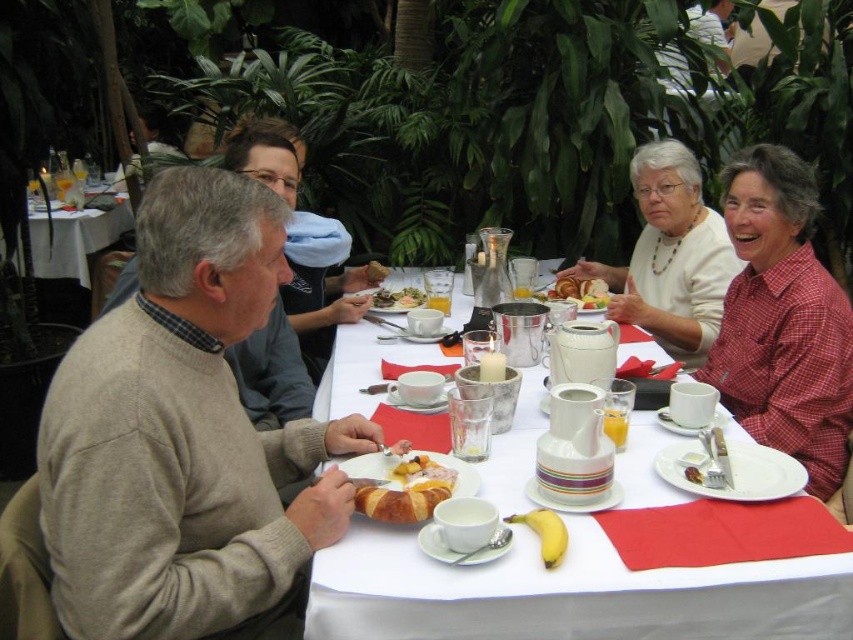
Question: Can you confirm if red checkered shirt at right is positioned to the right of golden croissant at center?

Choices:
 (A) no
 (B) yes

Answer: (B)

Question: Which of the following is the closest to the observer?

Choices:
 (A) white ceramic plate at center
 (B) light gray sweater at left

Answer: (B)

Question: Which of the following is the farthest from the observer?

Choices:
 (A) light gray sweater at left
 (B) white ceramic plate at center

Answer: (B)

Question: Can you confirm if light gray sweater at left is thinner than golden croissant at center?

Choices:
 (A) yes
 (B) no

Answer: (B)

Question: Among these points, which one is nearest to the camera?

Choices:
 (A) (601, 301)
 (B) (399, 509)
 (C) (148, 609)

Answer: (C)

Question: Does white matte sweater at upper right have a greater width compared to matte white plate at center?

Choices:
 (A) no
 (B) yes

Answer: (B)